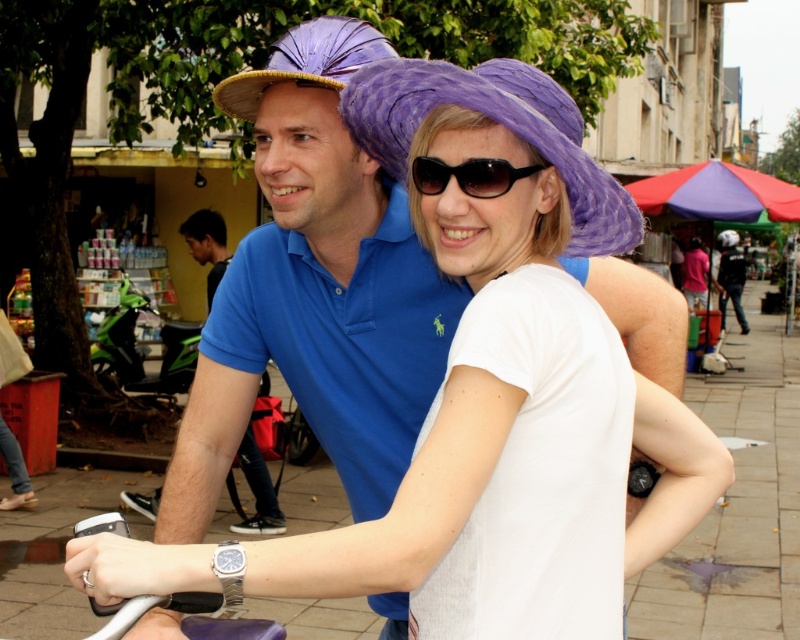
Question: Which of the following is the farthest from the observer?

Choices:
 (A) (544, 164)
 (B) (128, 493)
 (C) (425, 92)

Answer: (B)

Question: Among these objects, which one is farthest from the camera?

Choices:
 (A) white matte hat at upper center
 (B) purple paper hat at center
 (C) white matte helmet at upper right
 (D) purple woven hat at upper center

Answer: (A)

Question: Is the position of purple paper hat at center less distant than that of blue cotton polo shirt at center?

Choices:
 (A) no
 (B) yes

Answer: (B)

Question: Is blue cotton polo shirt at center positioned at the back of black plastic sunglasses at center?

Choices:
 (A) no
 (B) yes

Answer: (B)

Question: Estimate the real-world distances between objects in this image. Which object is farther from the black plastic sunglasses at center?

Choices:
 (A) white matte helmet at upper right
 (B) white matte hat at upper center
 (C) purple paper hat at center
 (D) blue cotton polo shirt at center

Answer: (A)

Question: Is purple paper hat at center to the left of white matte hat at upper center from the viewer's perspective?

Choices:
 (A) no
 (B) yes

Answer: (B)